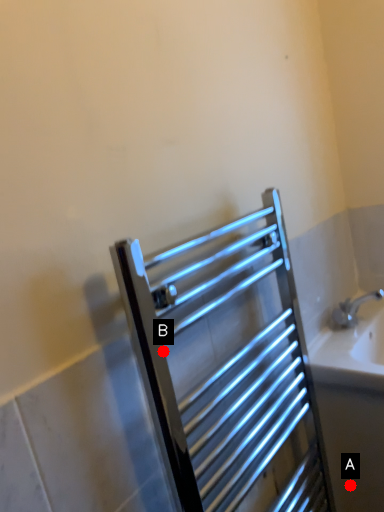
Question: Two points are circled on the image, labeled by A and B beside each circle. Which point appears closest to the camera in this image?

Choices:
 (A) A is closer
 (B) B is closer

Answer: (B)